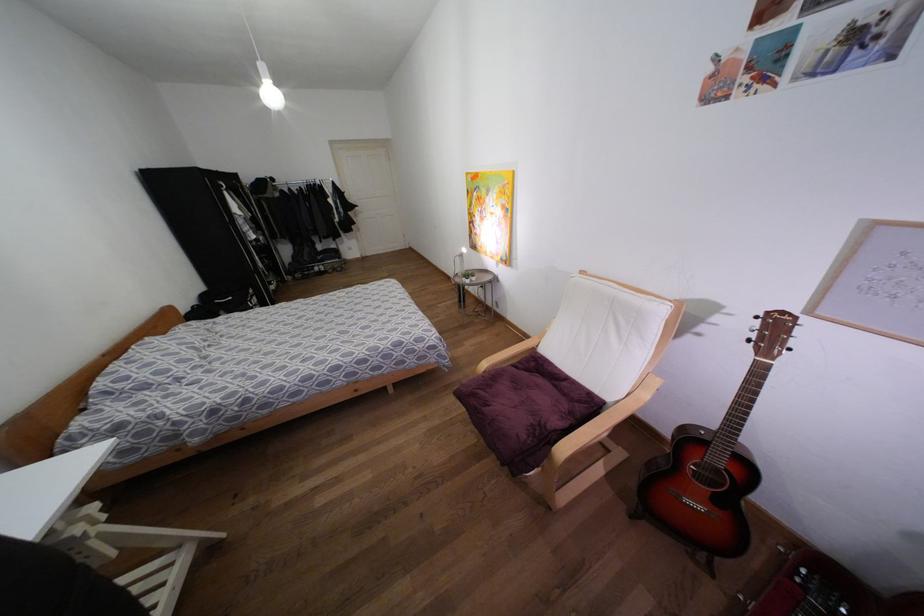
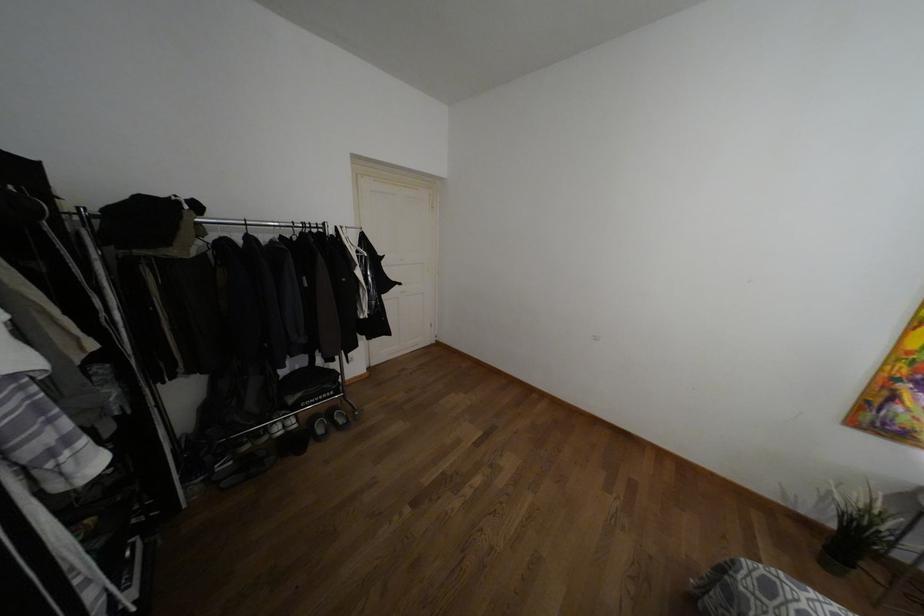
Find the pixel in the second image that matches point (319, 257) in the first image.

(290, 399)